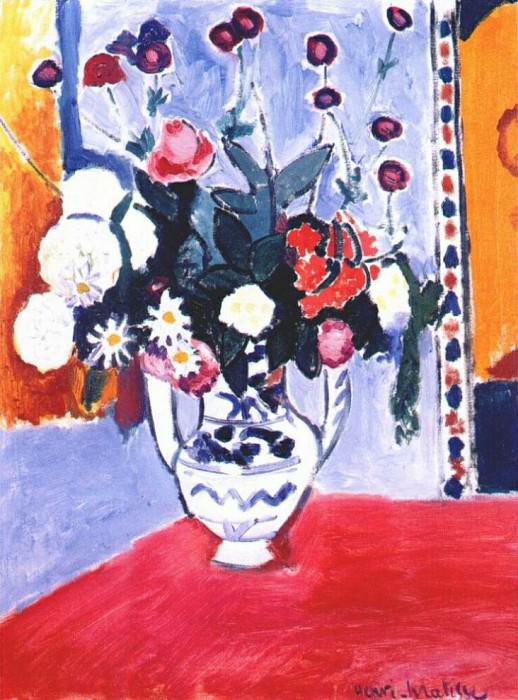
Where is `vase`? vase is located at coordinates (258, 493).